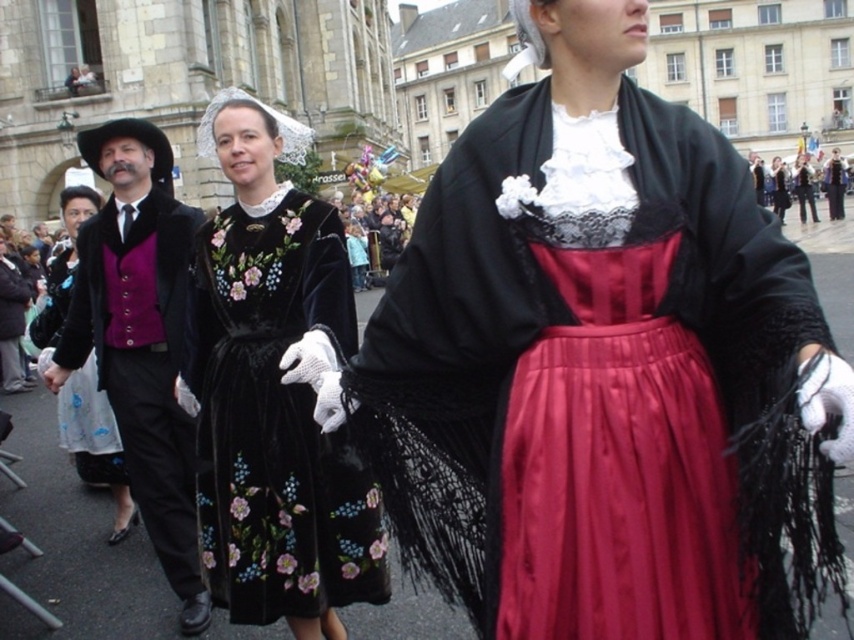
Does purple velvet vest at left have a lesser height compared to silky black dress at center?

No.

Does purple velvet vest at left have a greater width compared to silky black dress at center?

Incorrect, purple velvet vest at left's width does not surpass silky black dress at center's.

Between point (120, 456) and point (817, 220), which one is positioned behind?

The point (817, 220) is behind.

In order to click on purple velvet vest at left in this screenshot , I will do `click(95, 444)`.

Does velvet black coat at center lie in front of silky black skirt at center?

Yes.

Does velvet black coat at center have a greater width compared to silky black skirt at center?

No.

Is point (835, 200) farther from viewer compared to point (787, 193)?

No.

Where is `velvet black coat at center`? velvet black coat at center is located at coordinates (834, 184).

How distant is velvet black coat at center from silky black dress at center?

A distance of 11.88 feet exists between velvet black coat at center and silky black dress at center.

Is velvet black coat at center shorter than silky black dress at center?

Correct, velvet black coat at center is not as tall as silky black dress at center.

At what (x,y) coordinates should I click in order to perform the action: click on velvet black coat at center. Please return your answer as a coordinate pair (x, y). The height and width of the screenshot is (640, 854). Looking at the image, I should click on (834, 184).